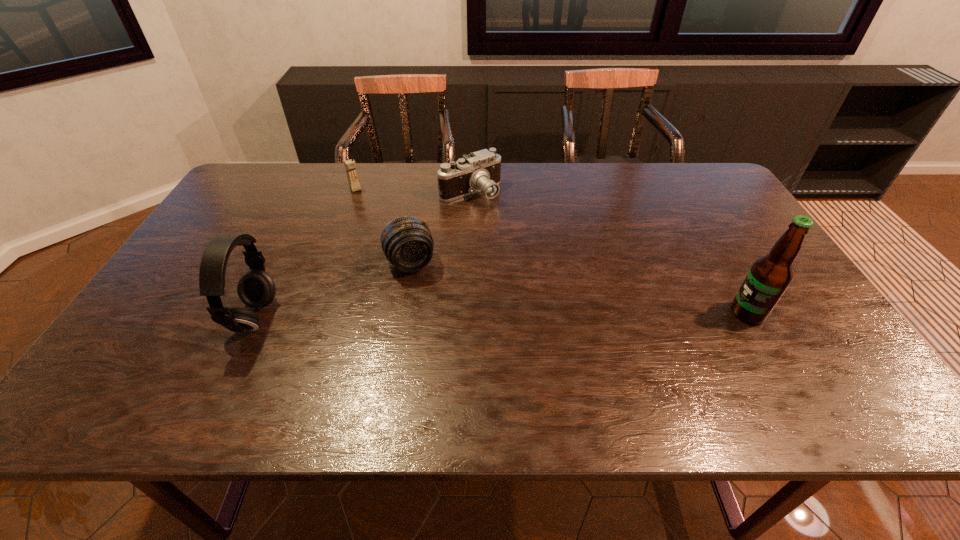
The width and height of the screenshot is (960, 540). What are the coordinates of `free region at the right edge of the desktop` in the screenshot? It's located at (724, 246).

I want to click on vacant space at the near left corner of the desktop, so click(161, 348).

The width and height of the screenshot is (960, 540). In order to click on vacant space at the far right corner of the desktop in this screenshot , I will do pyautogui.click(x=670, y=180).

Image resolution: width=960 pixels, height=540 pixels. In the image, there is a desktop. In order to click on vacant space at the near right corner in this screenshot , I will do `click(789, 367)`.

This screenshot has height=540, width=960. I want to click on free point between the camera and the telephoto lens, so click(440, 228).

Find the location of a particular element. This screenshot has height=540, width=960. vacant region between the tallest object and the cellular telephone is located at coordinates (552, 251).

Identify the location of vacant region between the rightmost object and the camera. [609, 253].

The height and width of the screenshot is (540, 960). I want to click on vacant space that is in between the third shortest object and the beer bottle, so point(552,251).

I want to click on free space between the third farthest object and the beer bottle, so click(x=579, y=288).

You are a GUI agent. You are given a task and a screenshot of the screen. Output one action in this format:
    pyautogui.click(x=<x>, y=<y>)
    Task: Click on the empty location between the telephoto lens and the rightmost object
    This screenshot has height=540, width=960.
    Given the screenshot: What is the action you would take?
    pyautogui.click(x=579, y=288)